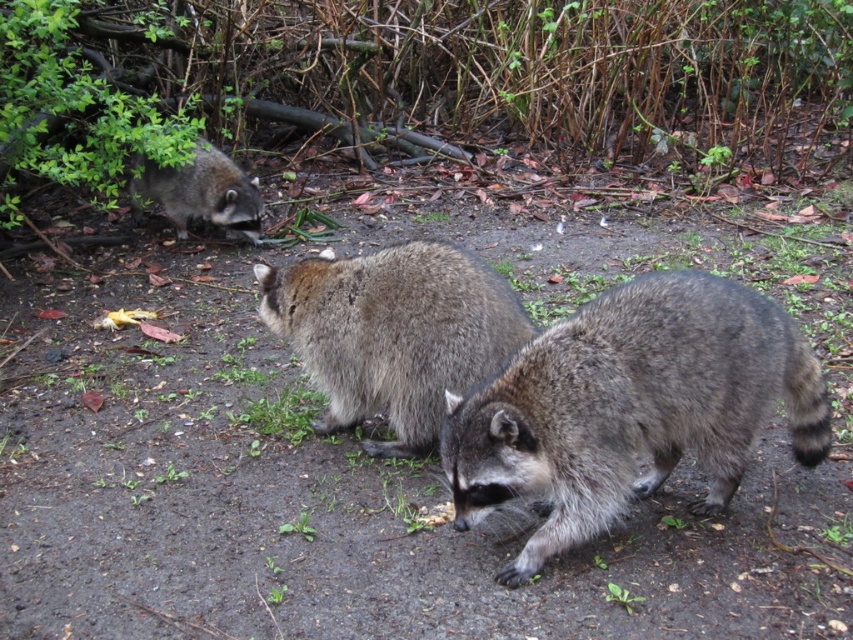
From the picture: You are a hiker who just spotted two raccoons in the forest. You see the fuzzy gray raccoon at center and the fuzzy brown raccoon at center. Which raccoon is positioned lower in the image?

The fuzzy gray raccoon at center is positioned lower than the fuzzy brown raccoon at center according to the description.

Consider the image. You are standing in a forest and want to place a camera trap at the point marked as point (460, 348). If the camera has a maximum effective range of 3 meters, will the camera be able to capture clear images of animals at that point?

The distance of point (460, 348) from the camera is 3.05 meters, which is slightly beyond the camera trap maximum effective range of 3 meters. Therefore, the camera might not capture clear images at that point.